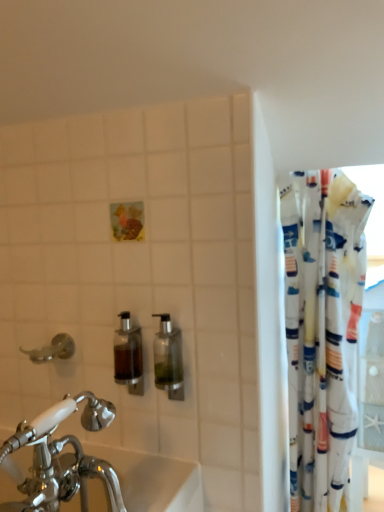
Question: Is white fabric curtain at right behind clear glass soap dispenser at center, which is the first soap dispenser in right-to-left order?

Choices:
 (A) yes
 (B) no

Answer: (A)

Question: Is white fabric curtain at right next to clear glass soap dispenser at center, arranged as the second soap dispenser when viewed from the left?

Choices:
 (A) no
 (B) yes

Answer: (A)

Question: Would you consider white fabric curtain at right to be distant from clear glass soap dispenser at center, which is the first soap dispenser in right-to-left order?

Choices:
 (A) no
 (B) yes

Answer: (A)

Question: Does white fabric curtain at right have a greater height compared to clear glass soap dispenser at center, which is the first soap dispenser in right-to-left order?

Choices:
 (A) yes
 (B) no

Answer: (A)

Question: From the image's perspective, is white fabric curtain at right below clear glass soap dispenser at center, which is the first soap dispenser in right-to-left order?

Choices:
 (A) yes
 (B) no

Answer: (A)

Question: From a real-world perspective, relative to brushed metal faucet at left, is clear glass soap dispenser at center, arranged as the second soap dispenser when viewed from the left, vertically above or below?

Choices:
 (A) above
 (B) below

Answer: (A)

Question: Is clear glass soap dispenser at center, arranged as the second soap dispenser when viewed from the left, taller or shorter than brushed metal faucet at left?

Choices:
 (A) tall
 (B) short

Answer: (A)

Question: Considering the positions of point (165, 344) and point (44, 358), is point (165, 344) closer or farther from the camera than point (44, 358)?

Choices:
 (A) closer
 (B) farther

Answer: (A)

Question: Considering the relative positions of clear glass soap dispenser at center, which is the first soap dispenser in right-to-left order, and brushed metal faucet at left in the image provided, is clear glass soap dispenser at center, which is the first soap dispenser in right-to-left order, to the left or to the right of brushed metal faucet at left?

Choices:
 (A) right
 (B) left

Answer: (A)

Question: Choose the correct answer: Is brushed metal faucet at left inside translucent glass soap dispenser at center, the 1th soap dispenser viewed from the left, or outside it?

Choices:
 (A) outside
 (B) inside

Answer: (A)

Question: In the image, is brushed metal faucet at left positioned in front of or behind translucent glass soap dispenser at center, the 1th soap dispenser viewed from the left?

Choices:
 (A) behind
 (B) front

Answer: (A)

Question: Considering the positions of point (71, 345) and point (132, 335), is point (71, 345) closer or farther from the camera than point (132, 335)?

Choices:
 (A) closer
 (B) farther

Answer: (B)

Question: Is brushed metal faucet at left taller or shorter than translucent glass soap dispenser at center, the 1th soap dispenser viewed from the left?

Choices:
 (A) tall
 (B) short

Answer: (B)

Question: Looking at their shapes, would you say brushed metal faucet at left is wider or thinner than clear glass soap dispenser at center, arranged as the second soap dispenser when viewed from the left?

Choices:
 (A) thin
 (B) wide

Answer: (B)

Question: Relative to clear glass soap dispenser at center, which is the first soap dispenser in right-to-left order, is brushed metal faucet at left in front or behind?

Choices:
 (A) front
 (B) behind

Answer: (B)